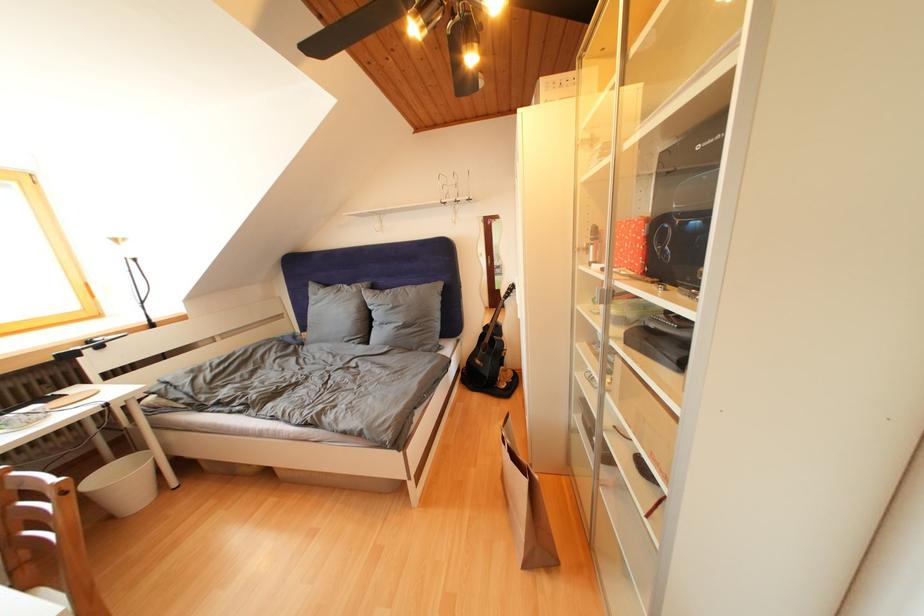
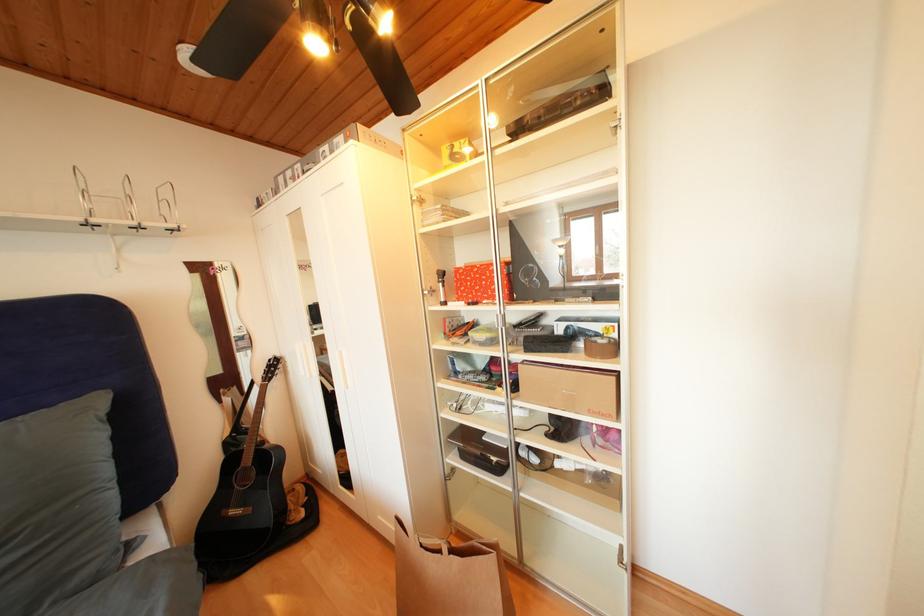
Question: The images are taken continuously from a first-person perspective. In which direction is your viewpoint rotating?

Choices:
 (A) Left
 (B) Right
 (C) Up
 (D) Down

Answer: (B)